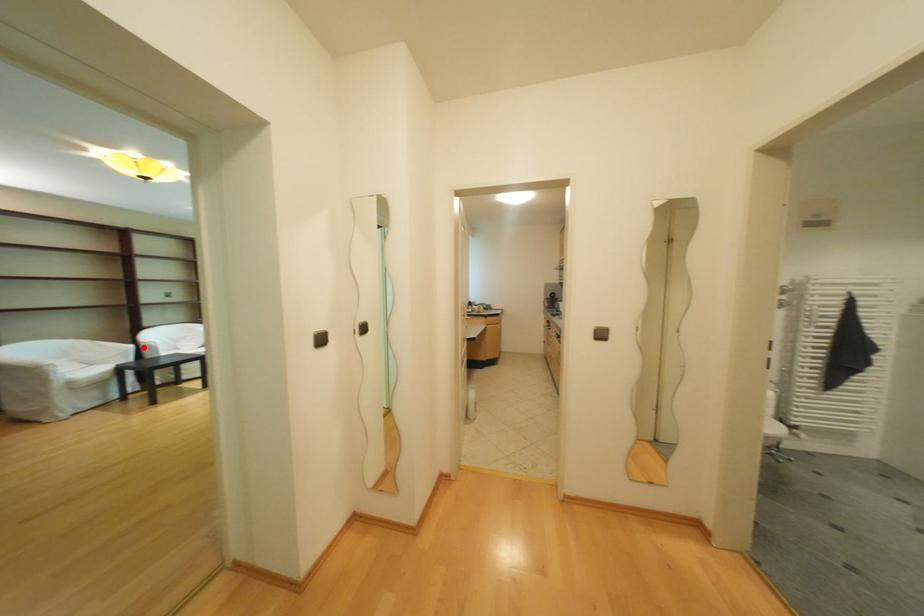
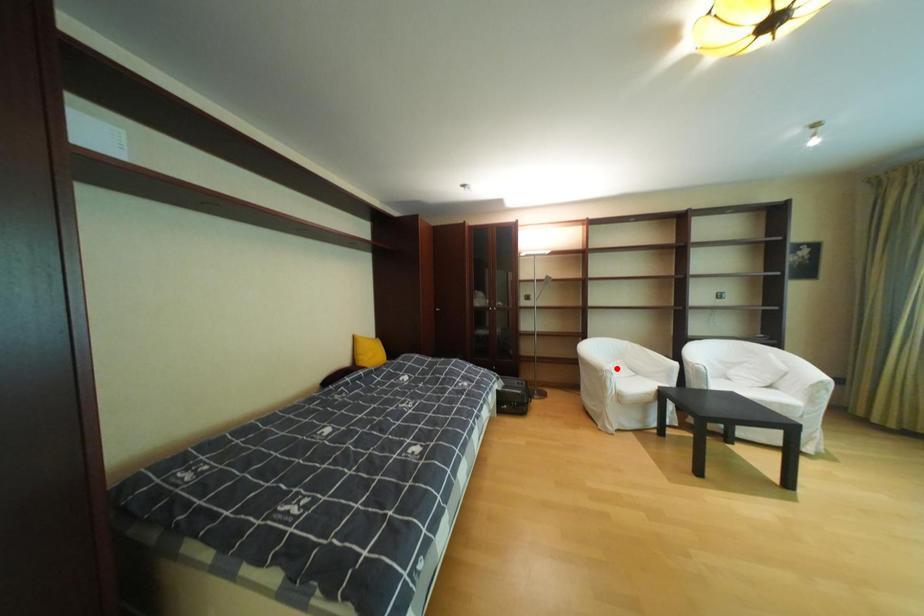
I am providing you with two images of the same scene from different viewpoints. A red point is marked on the first image and another point is marked on the second image. Are the points marked in image1 and image2 representing the same 3D position?

No